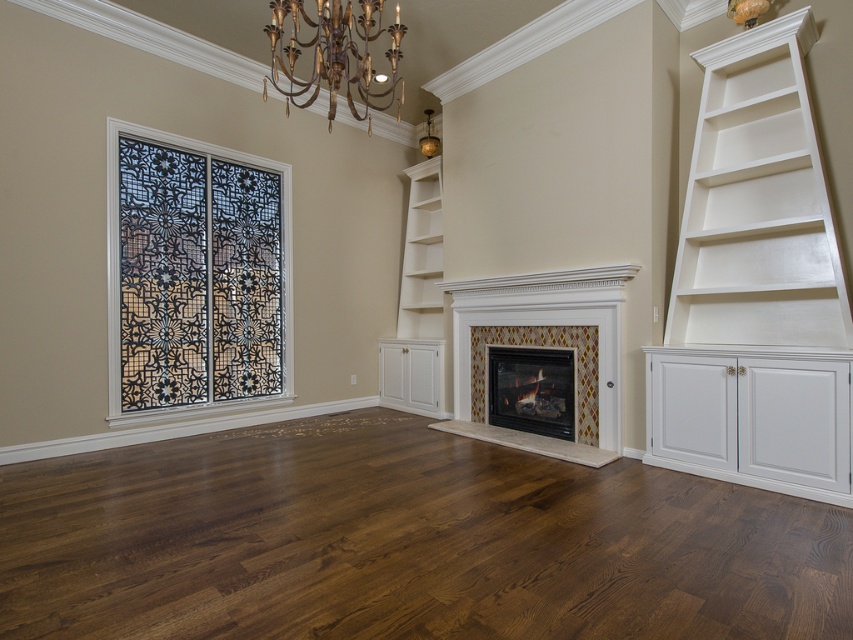
You are an interior designer planning to place a large sofa in the living room. The sofa will be positioned near the dark brown wood flooring at center and under the gold metallic chandelier at upper center. Which object will be more prominent in the room from an observer standing at the entrance?

The gold metallic chandelier at upper center is more prominent because it occupies more space than the dark brown wood flooring at center, as stated in the Objects Description.

You are organizing books in the living room and need to place a heavy sculpture on the highest available white shelf. Which object from the white painted wood bookshelf at right and the white wood shelf at center should you choose?

The white wood shelf at center is higher than the white painted wood bookshelf at right, so you should place the sculpture on the white wood shelf at center.